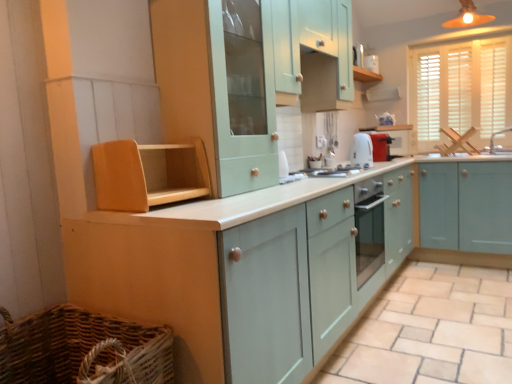
You are a GUI agent. You are given a task and a screenshot of the screen. Output one action in this format:
    pyautogui.click(x=<x>, y=<y>)
    Task: Click on the blank space situated above white wood blinds at upper right (from a real-world perspective)
    This screenshot has width=512, height=384.
    Given the screenshot: What is the action you would take?
    pyautogui.click(x=462, y=40)